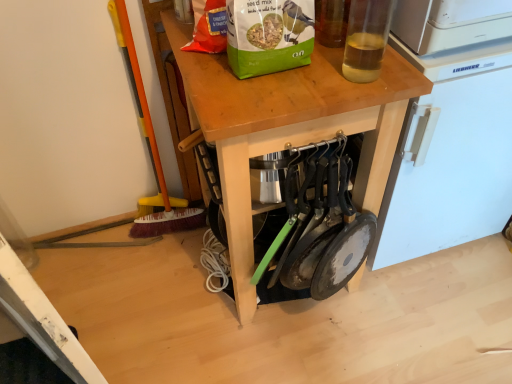
Find the location of a particular element. Image resolution: width=512 pixels, height=384 pixels. vacant space behind translucent glass bottle at upper right is located at coordinates (345, 45).